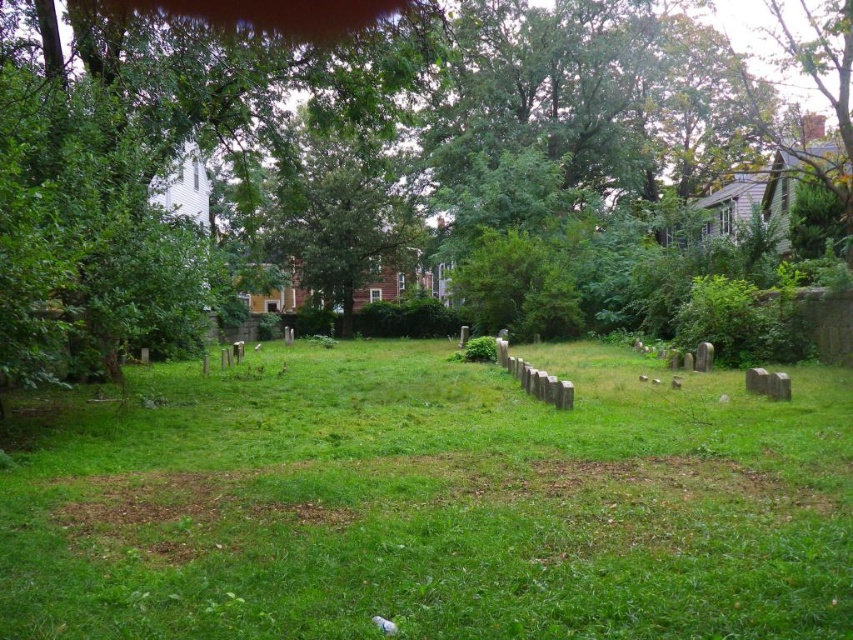
Find the location of a particular element. The height and width of the screenshot is (640, 853). green grassy area at center is located at coordinates (434, 504).

The image size is (853, 640). Find the location of `green grassy area at center`. green grassy area at center is located at coordinates (434, 504).